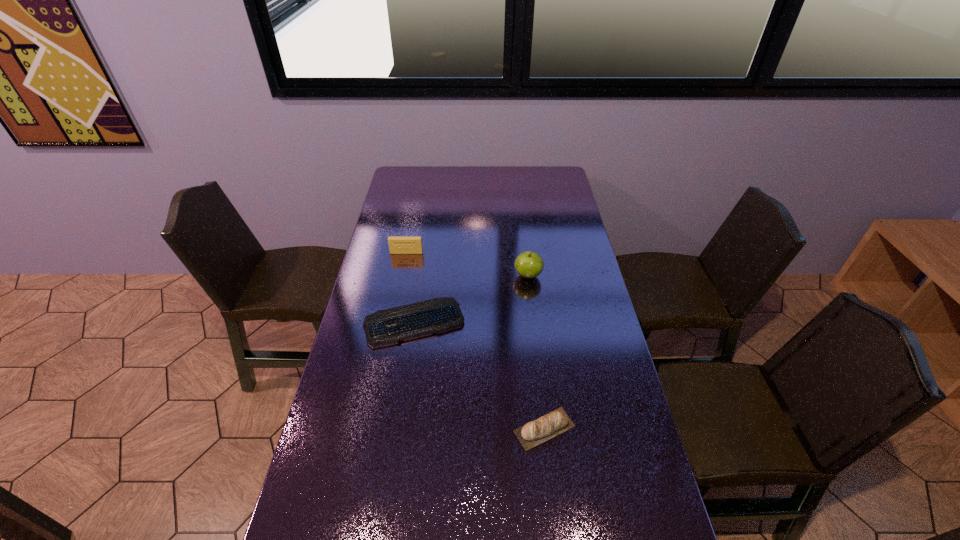
This screenshot has width=960, height=540. Identify the location of free space between the third farthest object and the nearest object. (479, 375).

This screenshot has width=960, height=540. What are the coordinates of `unoccupied position between the videotape and the shortest object` in the screenshot? It's located at pos(411,287).

Where is `empty space that is in between the third nearest object and the videotape`? The image size is (960, 540). empty space that is in between the third nearest object and the videotape is located at coordinates (468, 264).

Where is `free space that is in between the third shortest object and the apple`? The image size is (960, 540). free space that is in between the third shortest object and the apple is located at coordinates (468, 264).

Select which object is the closest to the videotape. Please provide its 2D coordinates. Your answer should be formatted as a tuple, i.e. [(x, y)], where the tuple contains the x and y coordinates of a point satisfying the conditions above.

[(384, 327)]

The width and height of the screenshot is (960, 540). Identify the location of object that is the third closest to the nearest object. (x=397, y=245).

The image size is (960, 540). Find the location of `vacant space that satisfies the following two spatial constraints: 1. at the front of the nearest object with spools; 2. on the right side of the second tallest object`. vacant space that satisfies the following two spatial constraints: 1. at the front of the nearest object with spools; 2. on the right side of the second tallest object is located at coordinates (372, 429).

Locate an element on the screen. This screenshot has height=540, width=960. free space that satisfies the following two spatial constraints: 1. at the front of the farthest object with spools; 2. on the left side of the apple is located at coordinates (402, 276).

You are a GUI agent. You are given a task and a screenshot of the screen. Output one action in this format:
    pyautogui.click(x=<x>, y=<y>)
    Task: Click on the free spot that satisfies the following two spatial constraints: 1. on the back side of the computer keyboard; 2. on the left side of the apple
    This screenshot has width=960, height=540.
    Given the screenshot: What is the action you would take?
    pyautogui.click(x=421, y=276)

You are a GUI agent. You are given a task and a screenshot of the screen. Output one action in this format:
    pyautogui.click(x=<x>, y=<y>)
    Task: Click on the free space that satisfies the following two spatial constraints: 1. at the front of the third shortest object with spools; 2. on the right side of the apple
    Image resolution: width=960 pixels, height=540 pixels.
    Given the screenshot: What is the action you would take?
    pyautogui.click(x=402, y=276)